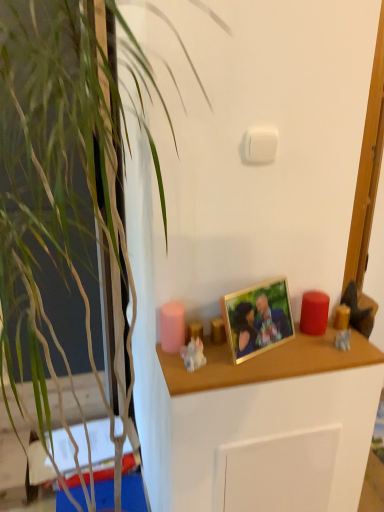
Question: Considering the relative positions of porcelain figurine at center, the 1th toy viewed from the left, and gold metallic picture frame at center in the image provided, is porcelain figurine at center, the 1th toy viewed from the left, in front of gold metallic picture frame at center?

Choices:
 (A) yes
 (B) no

Answer: (B)

Question: Is porcelain figurine at center, the second toy viewed from the back, beside gold metallic picture frame at center?

Choices:
 (A) no
 (B) yes

Answer: (A)

Question: Is porcelain figurine at center, positioned as the first toy in front-to-back order, smaller than gold metallic picture frame at center?

Choices:
 (A) yes
 (B) no

Answer: (A)

Question: From the image's perspective, is porcelain figurine at center, the second toy viewed from the back, located beneath gold metallic picture frame at center?

Choices:
 (A) yes
 (B) no

Answer: (A)

Question: Does porcelain figurine at center, which is the second toy from right to left, have a greater width compared to gold metallic picture frame at center?

Choices:
 (A) no
 (B) yes

Answer: (A)

Question: Is porcelain figurine at center, positioned as the first toy in front-to-back order, outside of gold metallic picture frame at center?

Choices:
 (A) yes
 (B) no

Answer: (A)

Question: From the image's perspective, is white plastic light switch at upper center below wooden shelf at center?

Choices:
 (A) no
 (B) yes

Answer: (A)

Question: Is wooden shelf at center surrounded by white plastic light switch at upper center?

Choices:
 (A) no
 (B) yes

Answer: (A)

Question: Considering the relative positions of white plastic light switch at upper center and wooden shelf at center in the image provided, is white plastic light switch at upper center in front of wooden shelf at center?

Choices:
 (A) no
 (B) yes

Answer: (A)

Question: Would you say white plastic light switch at upper center is outside wooden shelf at center?

Choices:
 (A) yes
 (B) no

Answer: (A)

Question: From a real-world perspective, is white plastic light switch at upper center physically below wooden shelf at center?

Choices:
 (A) yes
 (B) no

Answer: (B)

Question: Does white plastic light switch at upper center have a larger size compared to wooden shelf at center?

Choices:
 (A) yes
 (B) no

Answer: (B)

Question: Is translucent amber glass candle at right, positioned as the first candle in right-to-left order, shorter than porcelain figurine at center, which is the second toy from right to left?

Choices:
 (A) no
 (B) yes

Answer: (B)